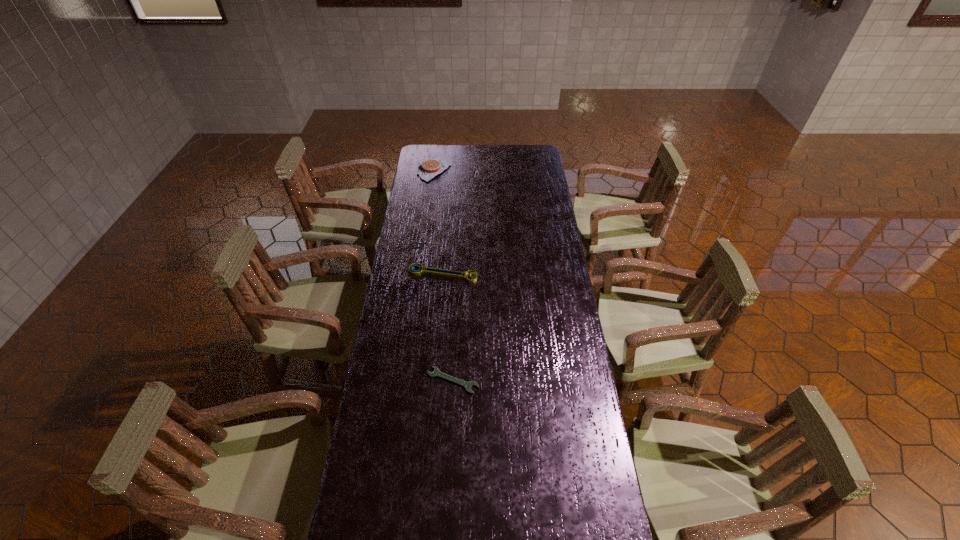
The width and height of the screenshot is (960, 540). Find the location of `empty space that is in between the second farthest object and the nearer wrench`. empty space that is in between the second farthest object and the nearer wrench is located at coordinates (448, 327).

Find the location of `free space between the second nearest object and the tallest object`. free space between the second nearest object and the tallest object is located at coordinates (439, 221).

Identify the location of empty space between the taller wrench and the nearest object. The width and height of the screenshot is (960, 540). (448, 327).

Locate an element on the screen. The height and width of the screenshot is (540, 960). the closest object relative to the second nearest object is located at coordinates (436, 373).

Select which object is the second closest to the nearest object. Please provide its 2D coordinates. Your answer should be formatted as a tuple, i.e. [(x, y)], where the tuple contains the x and y coordinates of a point satisfying the conditions above.

[(430, 168)]

Where is `vacant area that satisfies the following two spatial constraints: 1. on the front side of the farthest object; 2. on the left side of the taller wrench`? vacant area that satisfies the following two spatial constraints: 1. on the front side of the farthest object; 2. on the left side of the taller wrench is located at coordinates (420, 273).